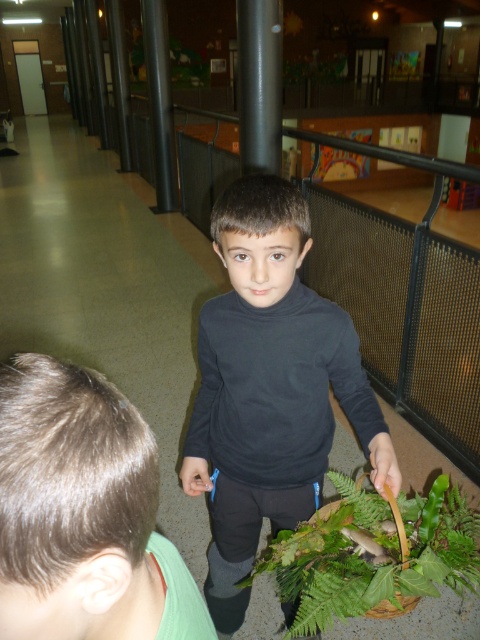
From the picture: You are a visitor in the hallway and want to know if the green leafy plant at lower center can fit under the satin black pole at upper center without touching it. Can you determine this based on their heights?

The green leafy plant at lower center is shorter than the satin black pole at upper center, so it can fit under the satin black pole at upper center without touching it.